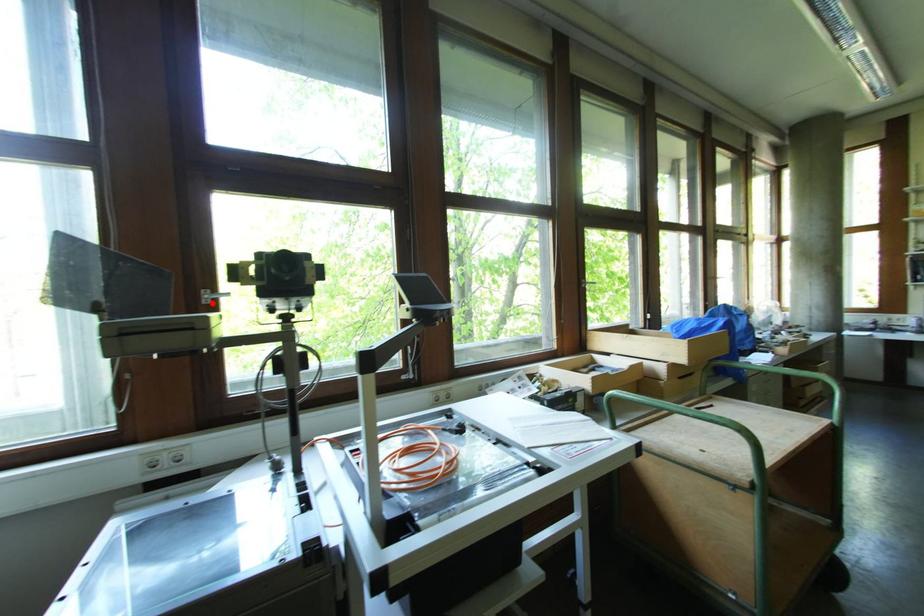
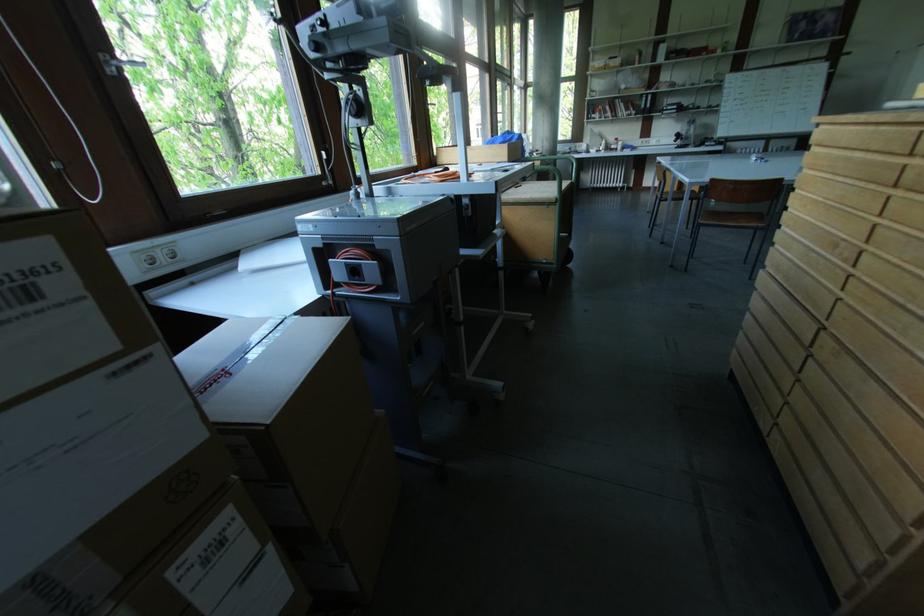
Where in the second image is the point corresponding to the highlighted location from the first image?

(116, 73)